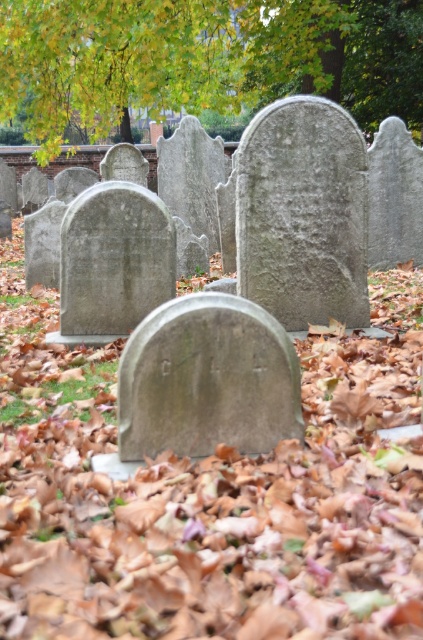
Question: Does green leafy tree at upper center have a smaller size compared to gray stone gravestone at center?

Choices:
 (A) no
 (B) yes

Answer: (B)

Question: Among these objects, which one is nearest to the camera?

Choices:
 (A) green leafy tree at upper center
 (B) gray stone gravestone at center

Answer: (B)

Question: Where is green leafy tree at upper center located in relation to gray stone gravestone at center in the image?

Choices:
 (A) left
 (B) right

Answer: (A)

Question: Among these points, which one is farthest from the camera?

Choices:
 (A) (225, 401)
 (B) (107, 84)

Answer: (B)

Question: Which of the following is the farthest from the observer?

Choices:
 (A) gray stone gravestone at center
 (B) green leafy tree at upper center

Answer: (B)

Question: Is the position of green leafy tree at upper center less distant than that of gray stone gravestone at center?

Choices:
 (A) yes
 (B) no

Answer: (B)